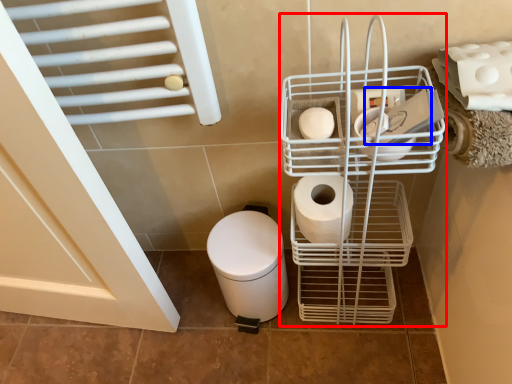
Question: Which object is further to the camera taking this photo, shopping cart (highlighted by a red box) or toilet paper (highlighted by a blue box)?

Choices:
 (A) shopping cart
 (B) toilet paper

Answer: (B)